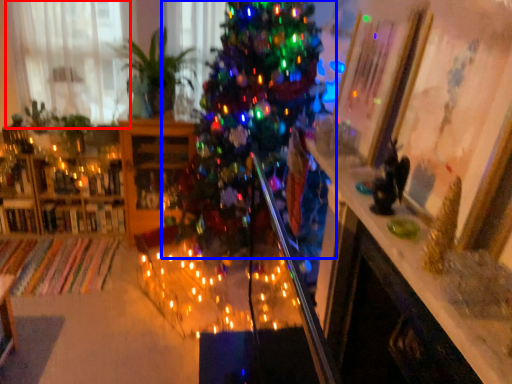
Question: Which object is closer to the camera taking this photo, window (highlighted by a red box) or christmas tree (highlighted by a blue box)?

Choices:
 (A) window
 (B) christmas tree

Answer: (B)